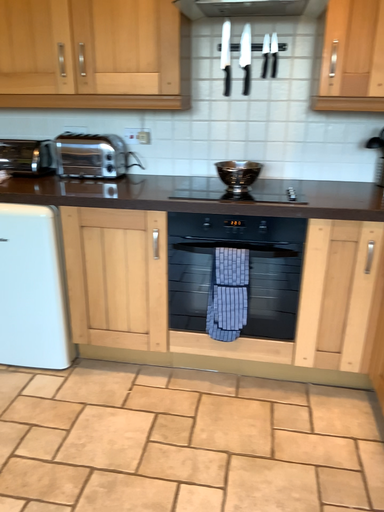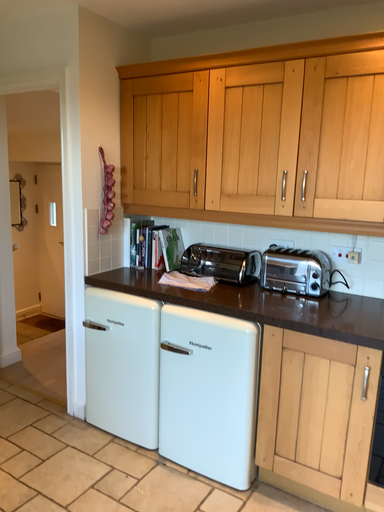
Question: Which way did the camera rotate in the video?

Choices:
 (A) rotated upward
 (B) rotated downward

Answer: (A)